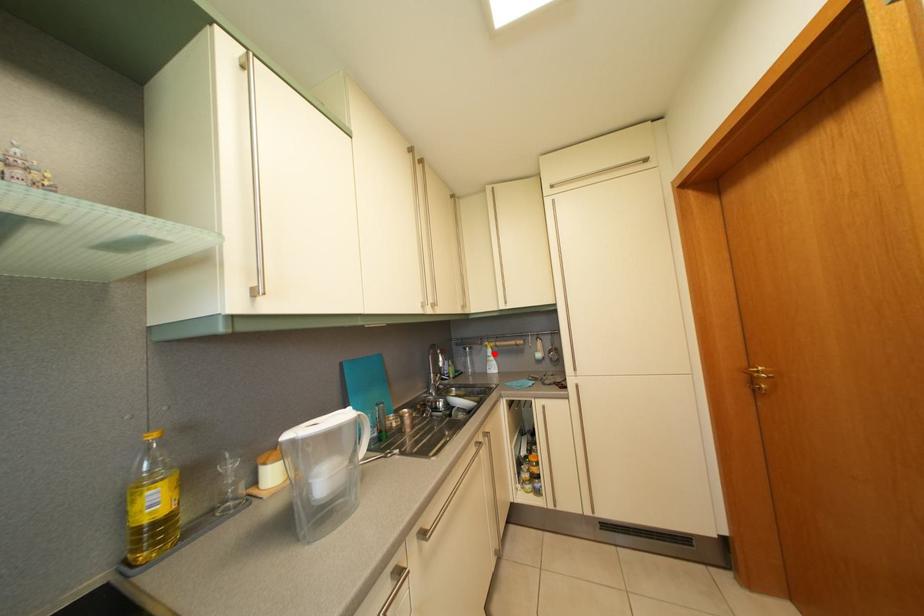
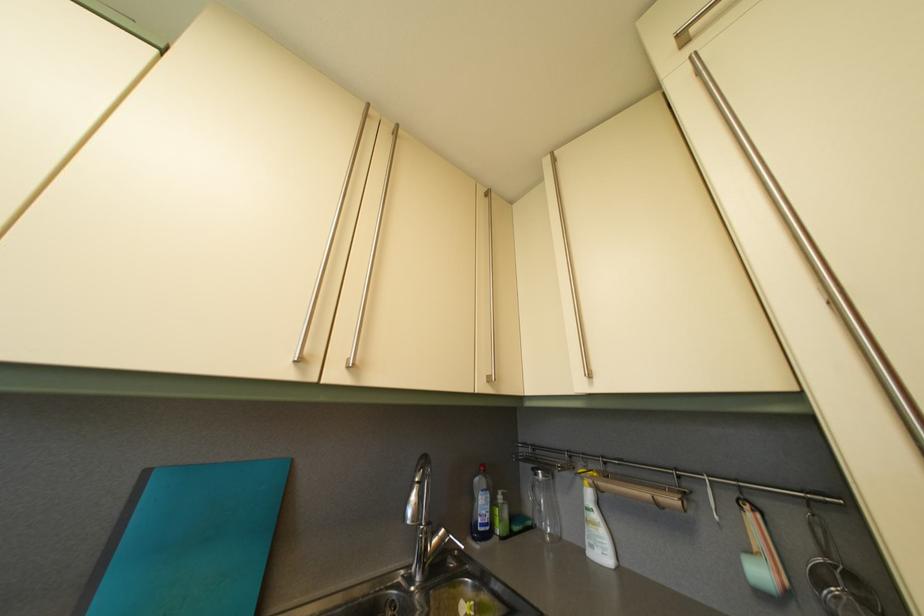
In the second image, find the point that corresponds to the highlighted location in the first image.

(590, 485)